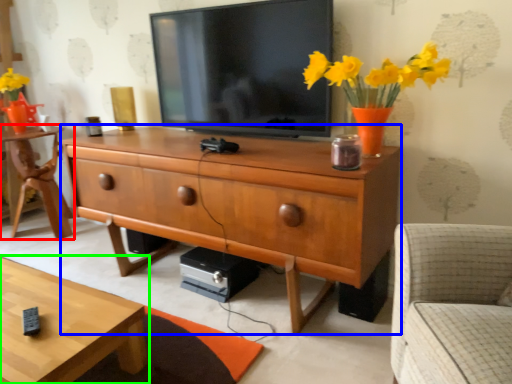
Question: Estimate the real-world distances between objects in this image. Which object is closer to desk (highlighted by a red box), chest of drawers (highlighted by a blue box) or coffee table (highlighted by a green box)?

Choices:
 (A) chest of drawers
 (B) coffee table

Answer: (A)